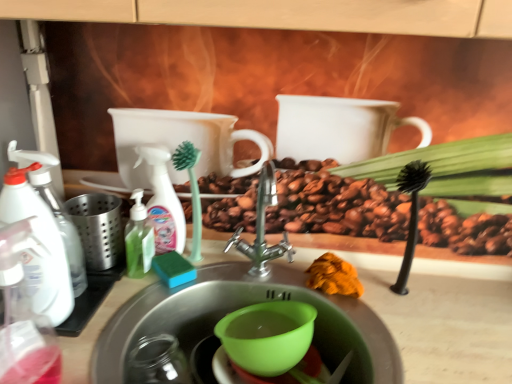
Identify the location of spots to the right of green translucent pump bottle at left, which is the second cleaning product in left-to-right order. The image size is (512, 384). (218, 272).